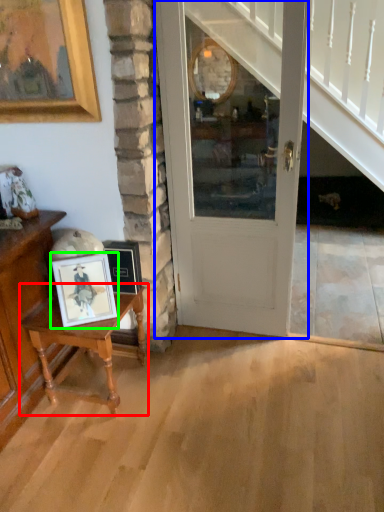
Question: Which is farther away from table (highlighted by a red box)? door (highlighted by a blue box) or picture frame (highlighted by a green box)?

Choices:
 (A) door
 (B) picture frame

Answer: (A)